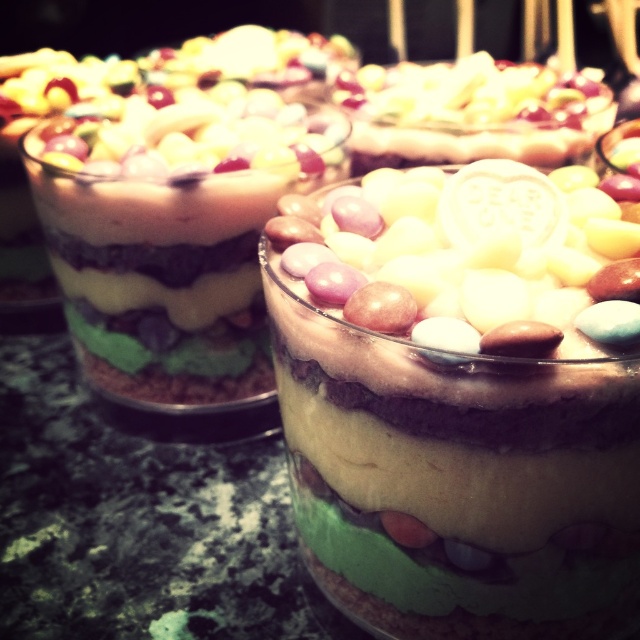
You are a dessert lover who wants to know what is at the center of the layered dessert in the image. According to the coordinates provided, what is located at point (458, 477)?

The point (458, 477) indicates smooth chocolate pudding at center.